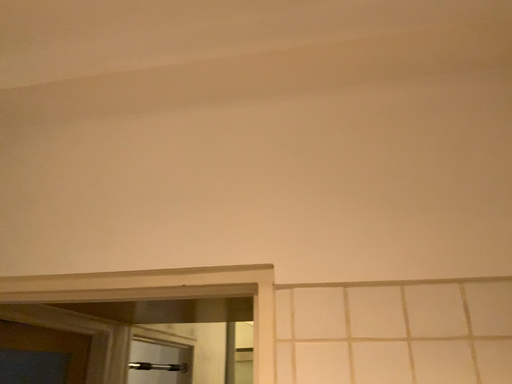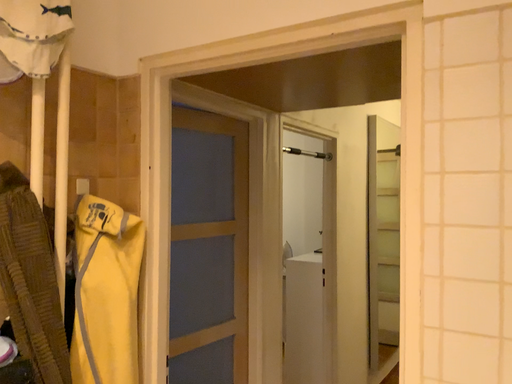
Question: Which way did the camera rotate in the video?

Choices:
 (A) rotated left
 (B) rotated right

Answer: (A)